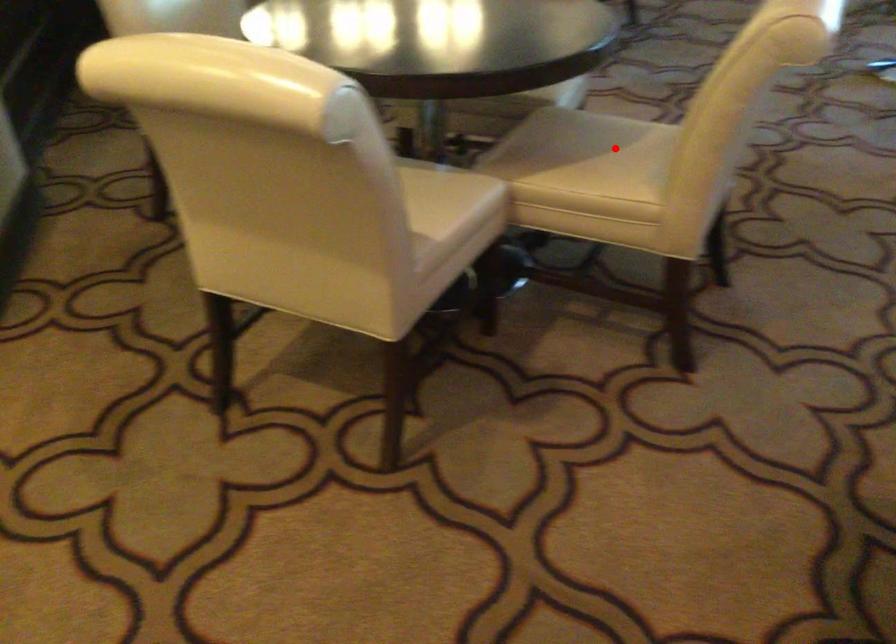
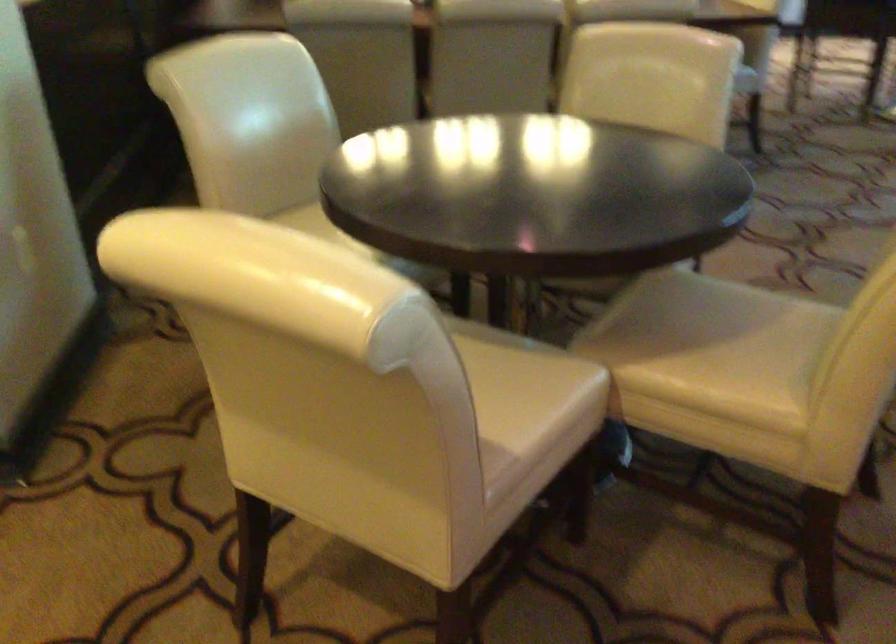
In the second image, find the point that corresponds to the highlighted location in the first image.

(743, 330)